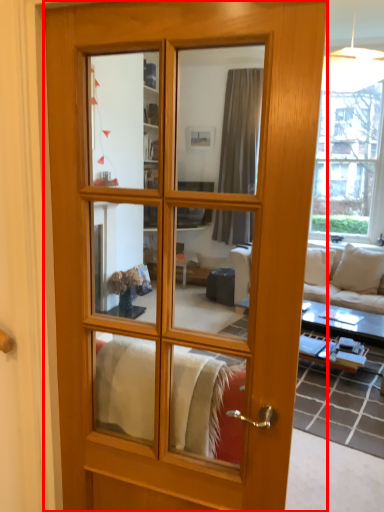
Question: From the image's perspective, where is door (annotated by the red box) located relative to studio couch?

Choices:
 (A) below
 (B) above

Answer: (B)